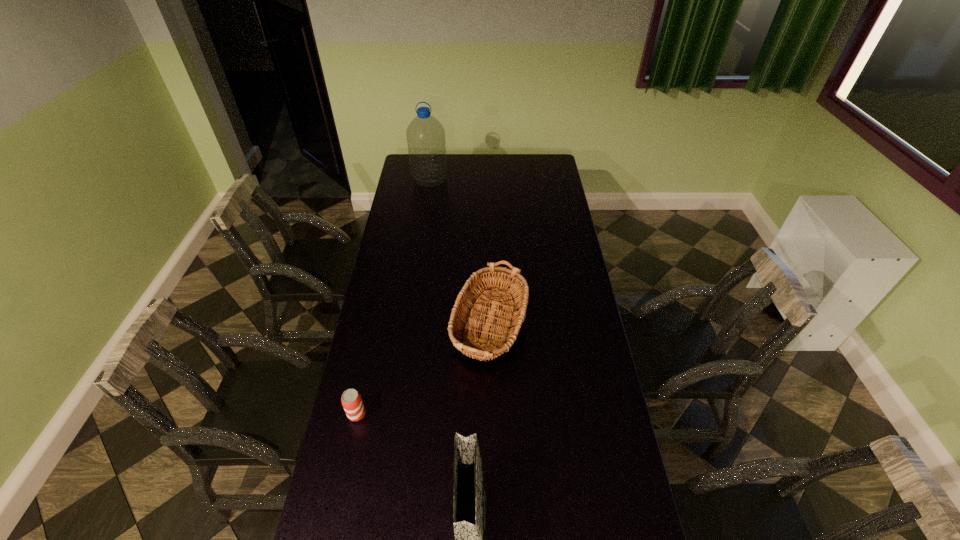
This screenshot has height=540, width=960. I want to click on object that is the closest to the tallest object, so click(466, 304).

Locate an element on the screen. object that is the second closest one to the beer can is located at coordinates (470, 479).

The height and width of the screenshot is (540, 960). I want to click on free space that satisfies the following two spatial constraints: 1. on the back side of the second shortest object; 2. on the right side of the shortest object, so click(374, 332).

This screenshot has height=540, width=960. I want to click on free location that satisfies the following two spatial constraints: 1. on the front side of the water jug; 2. on the right side of the second shortest object, so click(407, 332).